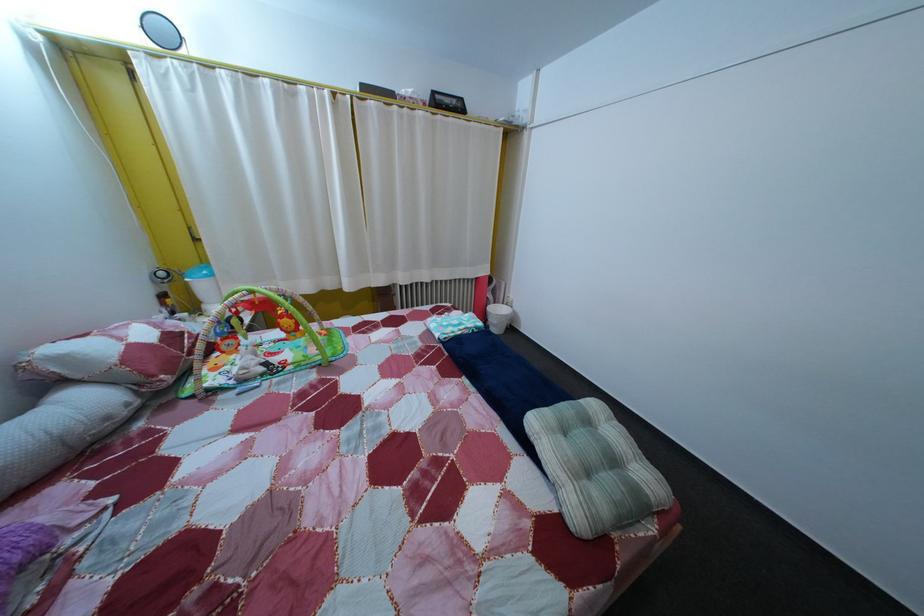
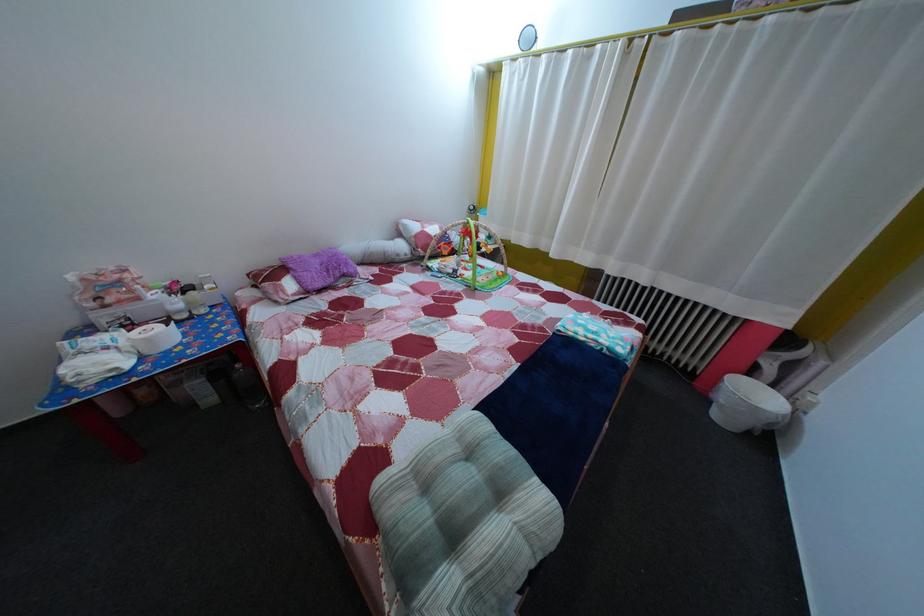
In the second image, find the point that corresponds to point 524,472 in the first image.

(442, 432)